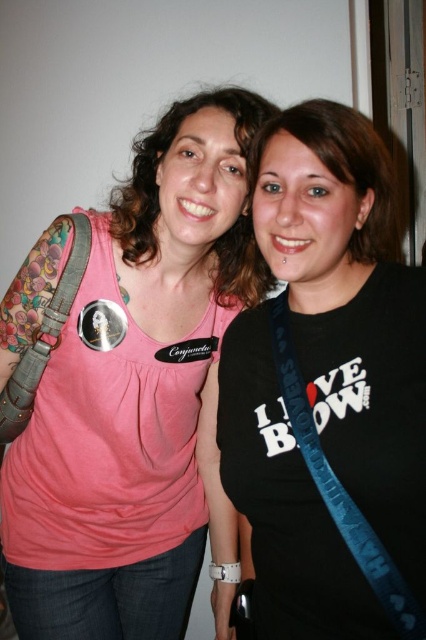
Locate an element on the screen. The image size is (426, 640). black matte t-shirt at center is located at coordinates (328, 392).

Who is shorter, black matte t-shirt at center or black matte shirt at center?

black matte shirt at center is shorter.

Which is in front, point (284, 460) or point (342, 122)?

Positioned in front is point (342, 122).

I want to click on black matte t-shirt at center, so click(x=328, y=392).

Between point (331, 371) and point (253, 241), which one is positioned in front?

Positioned in front is point (331, 371).

From the picture: Is black matte t-shirt at center thinner than matte black shirt at center?

Correct, black matte t-shirt at center's width is less than matte black shirt at center's.

Which is behind, point (350, 406) or point (149, 132)?

Point (149, 132)

Where is `black matte t-shirt at center`? The width and height of the screenshot is (426, 640). black matte t-shirt at center is located at coordinates (328, 392).

Can you confirm if pink fabric tank top at center is wider than black matte shirt at center?

Correct, the width of pink fabric tank top at center exceeds that of black matte shirt at center.

Does point (224, 284) lie behind point (287, 120)?

That is True.

Describe the element at coordinates (129, 387) in the screenshot. This screenshot has width=426, height=640. I see `pink fabric tank top at center` at that location.

This screenshot has height=640, width=426. In order to click on pink fabric tank top at center in this screenshot , I will do `click(129, 387)`.